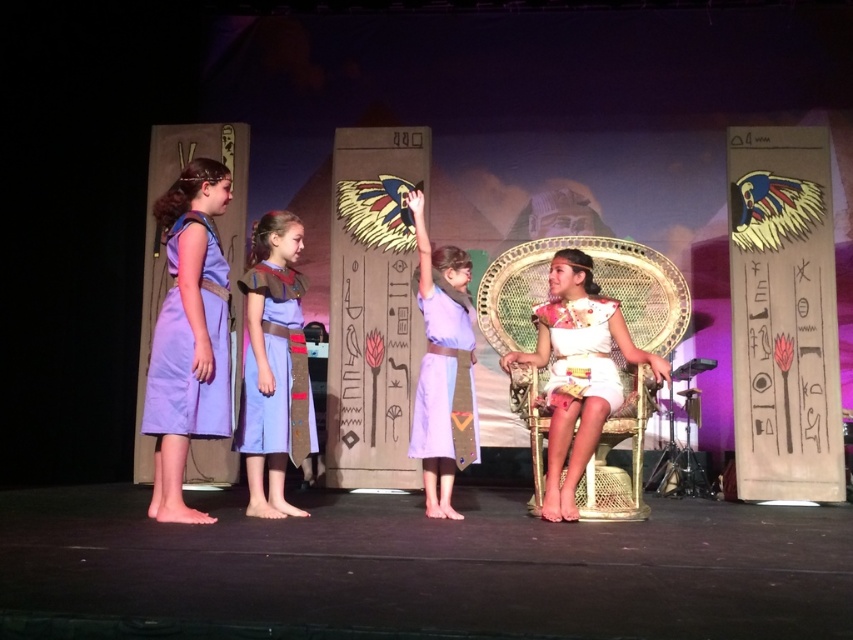
You are an actor standing at the center of the stage. You need to move to the white fabric chair at center. According to the coordinates given, is the chair located to your front, left, or right?

The white fabric chair at center is located at coordinates point (x=577, y=372). Since the actor is at the center of the stage, the chair is slightly to the right and forward from the actor.

You are an actor positioned at the center of the stage. You see two points marked on the stage floor. The first point is at coordinates point (550, 400) and the second point is at point (474, 435). Which point is closer to you?

Point (550, 400) is closer to the viewer than point (474, 435).